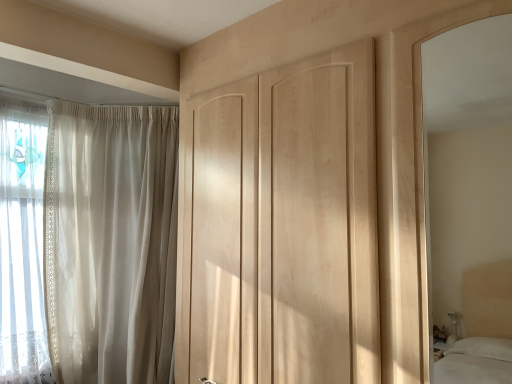
Question: From a real-world perspective, is natural wood door at center located beneath sheer white curtain at left?

Choices:
 (A) yes
 (B) no

Answer: (B)

Question: Could you tell me if natural wood door at center is turned towards sheer white curtain at left?

Choices:
 (A) no
 (B) yes

Answer: (A)

Question: Does natural wood door at center have a lesser height compared to sheer white curtain at left?

Choices:
 (A) yes
 (B) no

Answer: (A)

Question: Is natural wood door at center positioned behind sheer white curtain at left?

Choices:
 (A) no
 (B) yes

Answer: (A)

Question: From a real-world perspective, is natural wood door at center on sheer white curtain at left?

Choices:
 (A) yes
 (B) no

Answer: (A)

Question: Is natural wood door at center wider than sheer white curtain at left?

Choices:
 (A) yes
 (B) no

Answer: (B)

Question: Is sheer white curtain at left facing away from natural wood door at center?

Choices:
 (A) yes
 (B) no

Answer: (B)

Question: Is the position of sheer white curtain at left more distant than that of natural wood door at center?

Choices:
 (A) yes
 (B) no

Answer: (A)

Question: Is sheer white curtain at left closer to camera compared to natural wood door at center?

Choices:
 (A) yes
 (B) no

Answer: (B)

Question: Does sheer white curtain at left have a lesser height compared to natural wood door at center?

Choices:
 (A) no
 (B) yes

Answer: (A)

Question: From the image's perspective, is sheer white curtain at left on top of natural wood door at center?

Choices:
 (A) yes
 (B) no

Answer: (B)

Question: Is sheer white curtain at left far away from natural wood door at center?

Choices:
 (A) yes
 (B) no

Answer: (B)

Question: Can we say light wood/matte mirror at right lies outside natural wood door at center?

Choices:
 (A) no
 (B) yes

Answer: (B)